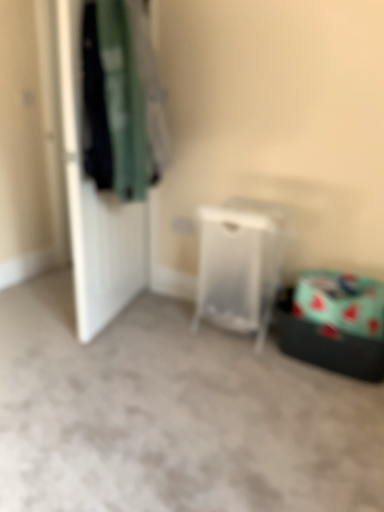
What do you see at coordinates (95, 204) in the screenshot?
I see `white matte door at left` at bounding box center [95, 204].

Locate an element on the screen. This screenshot has width=384, height=512. dark green fabric at left is located at coordinates (122, 99).

Measure the distance between point (111, 48) and camera.

1.78 meters.

Locate an element on the screen. Image resolution: width=384 pixels, height=512 pixels. white matte door at left is located at coordinates (95, 204).

Is point (273, 286) closer to viewer compared to point (110, 21)?

That is False.

From the image's perspective, relative to dark green fabric at left, is transparent plastic laundry basket at center above or below?

transparent plastic laundry basket at center is situated lower than dark green fabric at left in the image.

Which object is thinner, transparent plastic laundry basket at center or dark green fabric at left?

dark green fabric at left is thinner.

From a real-world perspective, who is located higher, transparent plastic laundry basket at center or dark green fabric at left?

dark green fabric at left is physically above.

How different are the orientations of white matte door at left and dark green fabric at left in degrees?

176 degrees.

From the picture: Between white matte door at left and dark green fabric at left, which one has smaller width?

With smaller width is white matte door at left.

From the image's perspective, is white matte door at left positioned above or below dark green fabric at left?

Based on their image positions, white matte door at left is located beneath dark green fabric at left.

Is white matte door at left to the right of dark green fabric at left from the viewer's perspective?

No, white matte door at left is not to the right of dark green fabric at left.

I want to click on door on the left of transparent plastic laundry basket at center, so click(x=95, y=204).

Does transparent plastic laundry basket at center have a lesser width compared to white matte door at left?

No.

Is transparent plastic laundry basket at center not close to white matte door at left?

No, there isn't a large distance between transparent plastic laundry basket at center and white matte door at left.

How distant is white matte door at left from transparent plastic laundry basket at center?

white matte door at left and transparent plastic laundry basket at center are 24.30 inches apart.

Could you tell me if white matte door at left is turned towards transparent plastic laundry basket at center?

No, white matte door at left is not oriented towards transparent plastic laundry basket at center.

In the scene shown: Can you confirm if white matte door at left is positioned to the left of transparent plastic laundry basket at center?

Yes, white matte door at left is to the left of transparent plastic laundry basket at center.

Can you tell me how much white matte door at left and transparent plastic laundry basket at center differ in facing direction?

white matte door at left and transparent plastic laundry basket at center are facing 76.1 degrees away from each other.

Considering the relative sizes of dark green fabric at left and white matte door at left in the image provided, is dark green fabric at left shorter than white matte door at left?

Correct, dark green fabric at left is not as tall as white matte door at left.

In the scene shown: Is dark green fabric at left with white matte door at left?

No, dark green fabric at left is not touching white matte door at left.

From a real-world perspective, is dark green fabric at left on white matte door at left?

Yes, from a real-world perspective, dark green fabric at left is over white matte door at left

Looking at their sizes, would you say dark green fabric at left is wider or thinner than transparent plastic laundry basket at center?

In the image, dark green fabric at left appears to be more narrow than transparent plastic laundry basket at center.

Are dark green fabric at left and transparent plastic laundry basket at center beside each other?

They are not placed beside each other.

From the image's perspective, would you say dark green fabric at left is shown under transparent plastic laundry basket at center?

Incorrect, from the image's perspective, dark green fabric at left is higher than transparent plastic laundry basket at center.

Which of these two, dark green fabric at left or transparent plastic laundry basket at center, stands taller?

dark green fabric at left.

What are the coordinates of `furniture that is under the dark green fabric at left (from a real-world perspective)` in the screenshot? It's located at (238, 268).

Locate an element on the screen. door to the left of dark green fabric at left is located at coordinates (95, 204).

In the scene shown: From the image, which object appears to be nearer to dark green fabric at left, white matte door at left or transparent plastic laundry basket at center?

Among the two, white matte door at left is located nearer to dark green fabric at left.

From the image, which object appears to be farther from white matte door at left, transparent plastic laundry basket at center or dark green fabric at left?

transparent plastic laundry basket at center.

Which object lies nearer to the anchor point transparent plastic laundry basket at center, white matte door at left or dark green fabric at left?

dark green fabric at left.

Looking at the image, which one is located closer to transparent plastic laundry basket at center, dark green fabric at left or white matte door at left?

dark green fabric at left is positioned closer to the anchor transparent plastic laundry basket at center.

From the picture: Estimate the real-world distances between objects in this image. Which object is closer to dark green fabric at left, transparent plastic laundry basket at center or white matte door at left?

Based on the image, white matte door at left appears to be nearer to dark green fabric at left.

Estimate the real-world distances between objects in this image. Which object is further from white matte door at left, dark green fabric at left or transparent plastic laundry basket at center?

transparent plastic laundry basket at center is further to white matte door at left.

Find the location of a particular element. Image resolution: width=384 pixels, height=512 pixels. door between dark green fabric at left and transparent plastic laundry basket at center in the vertical direction is located at coordinates (95, 204).